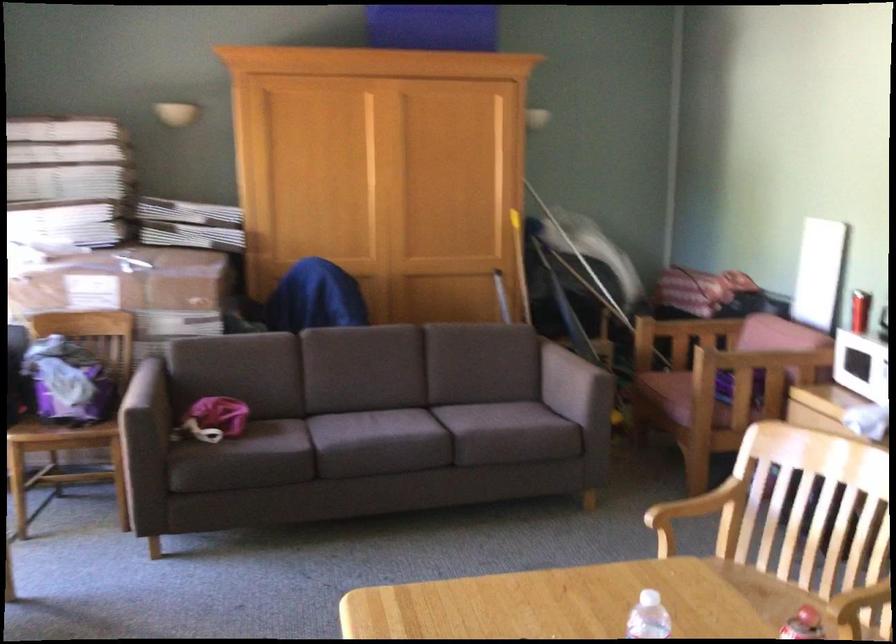
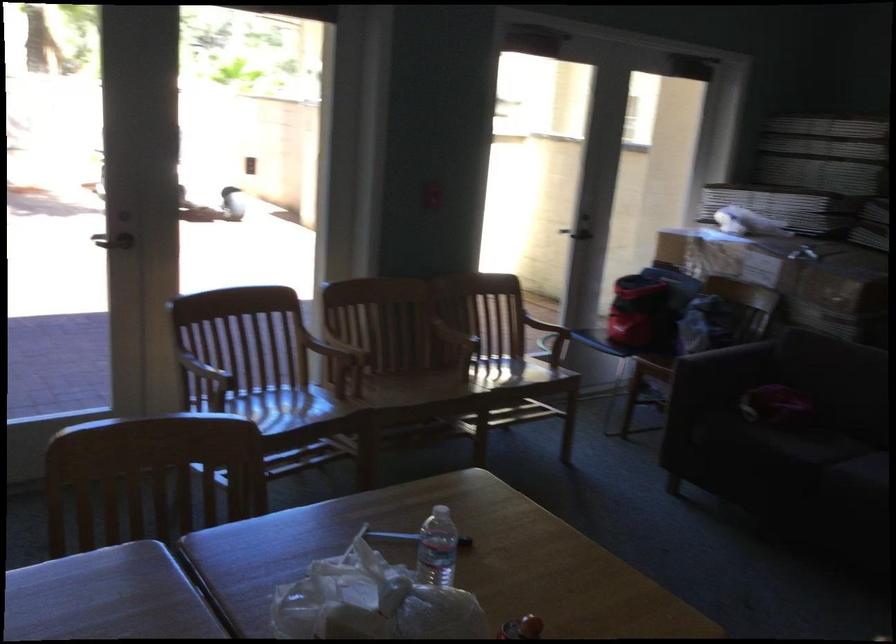
The point at (261, 389) is marked in the first image. Where is the corresponding point in the second image?

(843, 392)